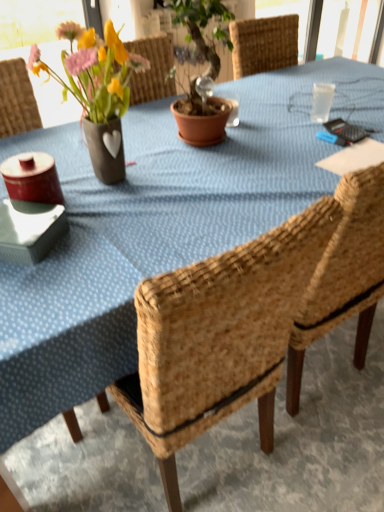
At what (x,y) coordinates should I click in order to perform the action: click on space that is in front of matte ceramic vase at upper left. Please return your answer as a coordinate pair (x, y). This screenshot has height=512, width=384. Looking at the image, I should click on (120, 229).